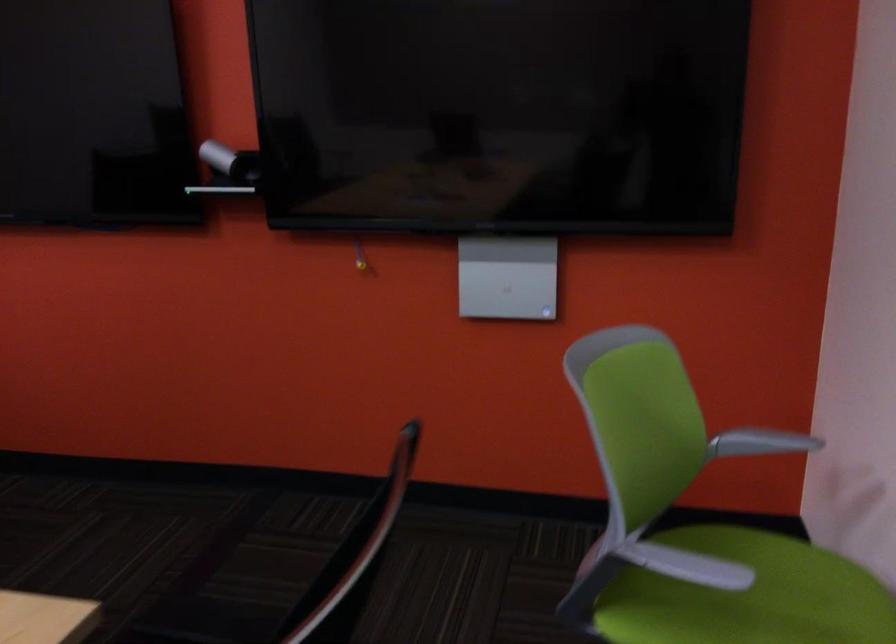
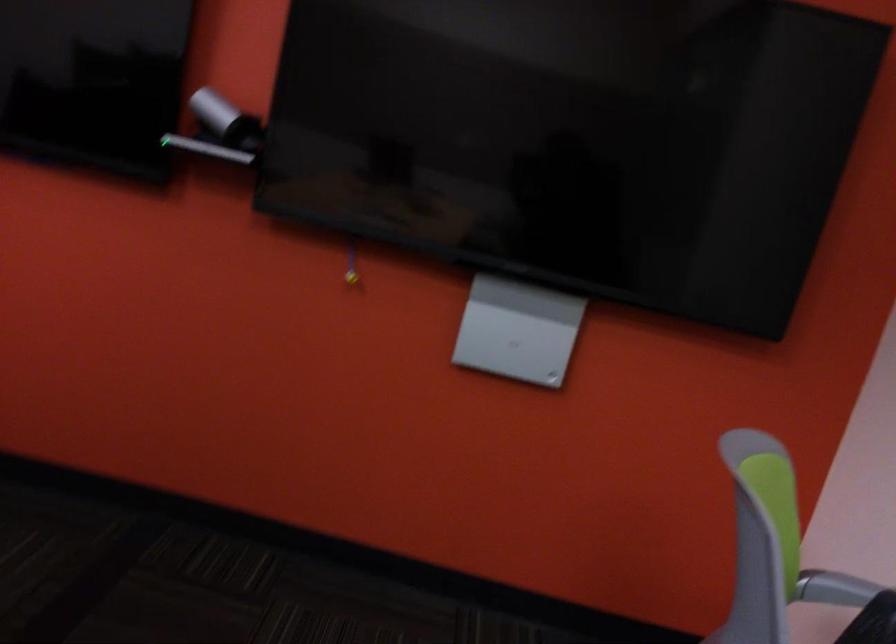
Question: The images are taken continuously from a first-person perspective. In which direction is your viewpoint rotating?

Choices:
 (A) Left
 (B) Right
 (C) Up
 (D) Down

Answer: (B)